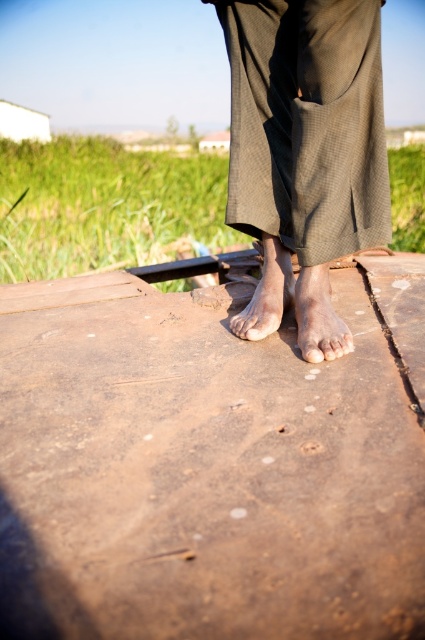
Question: Which point appears farthest from the camera in this image?

Choices:
 (A) (328, 292)
 (B) (254, 301)

Answer: (B)

Question: Is brown textured pants at center to the left of dry skin foot at center from the viewer's perspective?

Choices:
 (A) yes
 (B) no

Answer: (A)

Question: Does brown textured pants at center have a smaller size compared to brown matte foot at center?

Choices:
 (A) yes
 (B) no

Answer: (B)

Question: Which point appears closest to the camera in this image?

Choices:
 (A) (342, 348)
 (B) (331, 13)
 (C) (317, 355)

Answer: (B)

Question: Estimate the real-world distances between objects in this image. Which object is closer to the pale skin toe at center?

Choices:
 (A) brown textured pants at center
 (B) brown matte foot at center
 (C) rusty wood plank at center
 (D) dry skin foot at center

Answer: (D)

Question: Can you confirm if dry skin foot at center is positioned to the left of brown matte foot at center?

Choices:
 (A) no
 (B) yes

Answer: (A)